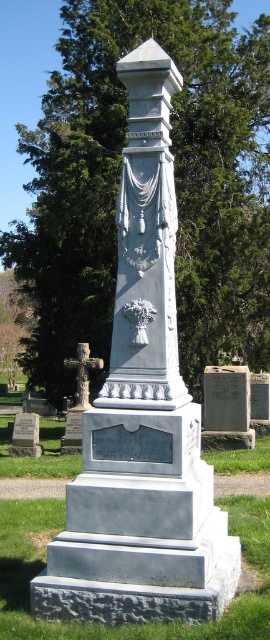
Question: Is green leafy tree at upper center positioned before dark gray stone cross at left?

Choices:
 (A) no
 (B) yes

Answer: (B)

Question: Which is nearer to the white marble monument at center?

Choices:
 (A) green leafy tree at upper center
 (B) dark gray stone cross at left

Answer: (B)

Question: Estimate the real-world distances between objects in this image. Which object is farther from the white marble monument at center?

Choices:
 (A) dark gray stone cross at left
 (B) green leafy tree at upper center

Answer: (B)

Question: Which point is closer to the camera?

Choices:
 (A) white marble monument at center
 (B) green leafy tree at upper center

Answer: (A)

Question: Is green leafy tree at upper center further to the viewer compared to white marble monument at center?

Choices:
 (A) yes
 (B) no

Answer: (A)

Question: Does white marble monument at center have a lesser width compared to dark gray stone cross at left?

Choices:
 (A) no
 (B) yes

Answer: (B)